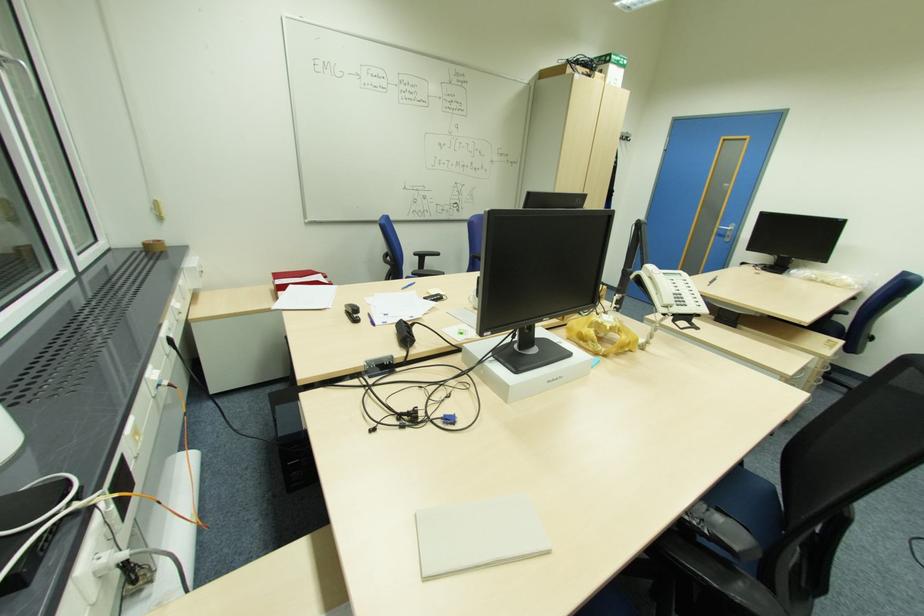
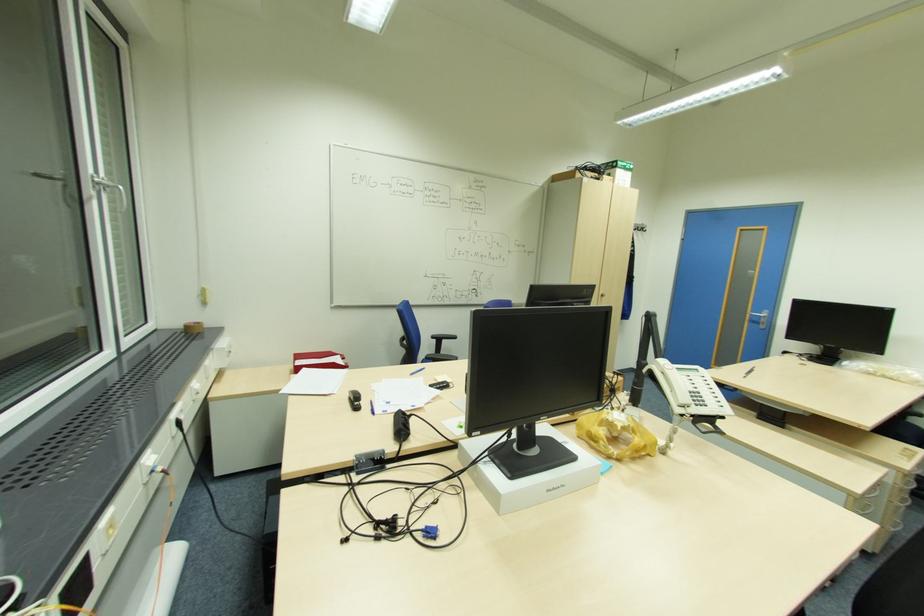
Where in the second image is the point corresponding to (x=371, y=320) from the first image?

(372, 408)